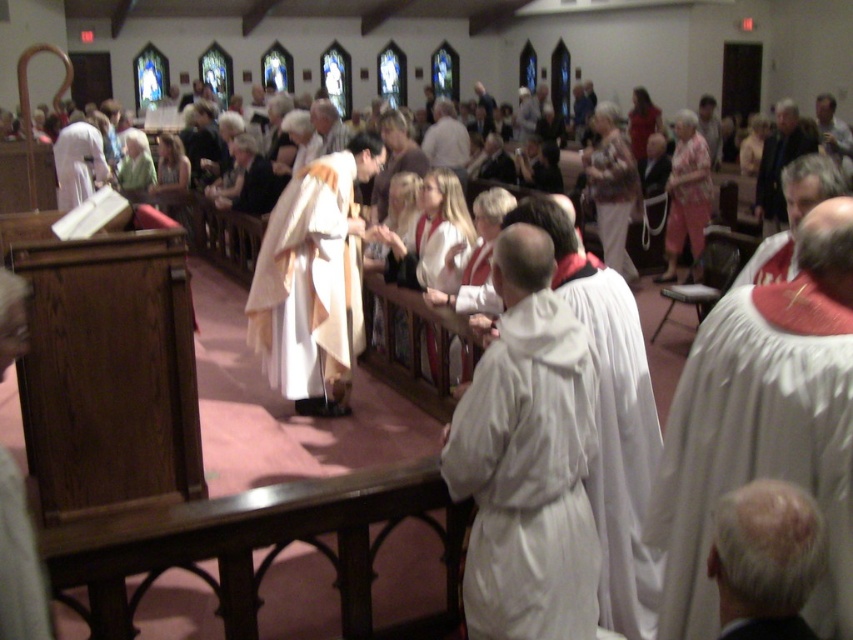
You are an attendee at the religious service and want to know which item is closer to the floor between the white soft fabric robe at center and the light brown leather jacket at center. Based on their positions, which one would you say is lower?

The white soft fabric robe at center is positioned under the light brown leather jacket at center, so it is closer to the floor.

You are attending a religious service in the church and notice two people wearing robes. The first is the white cloth robe at center, and the second is the white matte robe at lower right. Which robe is positioned more to the left side of the church?

The white cloth robe at center is positioned more to the left side of the church compared to the white matte robe at lower right.